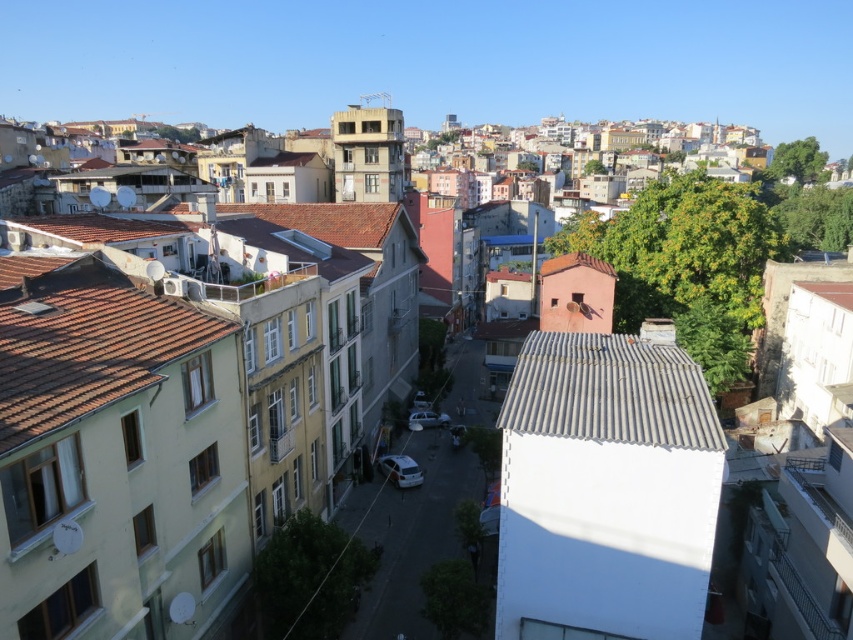
Is brown tile roof at left positioned at the back of white corrugated metal roof at center?

No, brown tile roof at left is in front of white corrugated metal roof at center.

Does brown tile roof at left have a smaller size compared to white corrugated metal roof at center?

Incorrect, brown tile roof at left is not smaller in size than white corrugated metal roof at center.

Is point (84, 259) farther from viewer compared to point (602, 362)?

Yes.

This screenshot has width=853, height=640. I want to click on brown tile roof at left, so click(x=88, y=342).